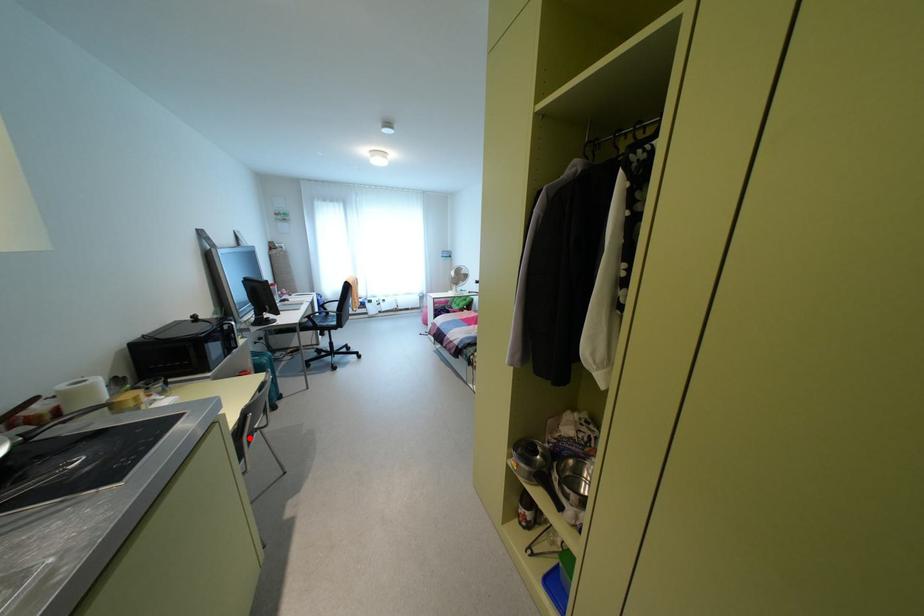
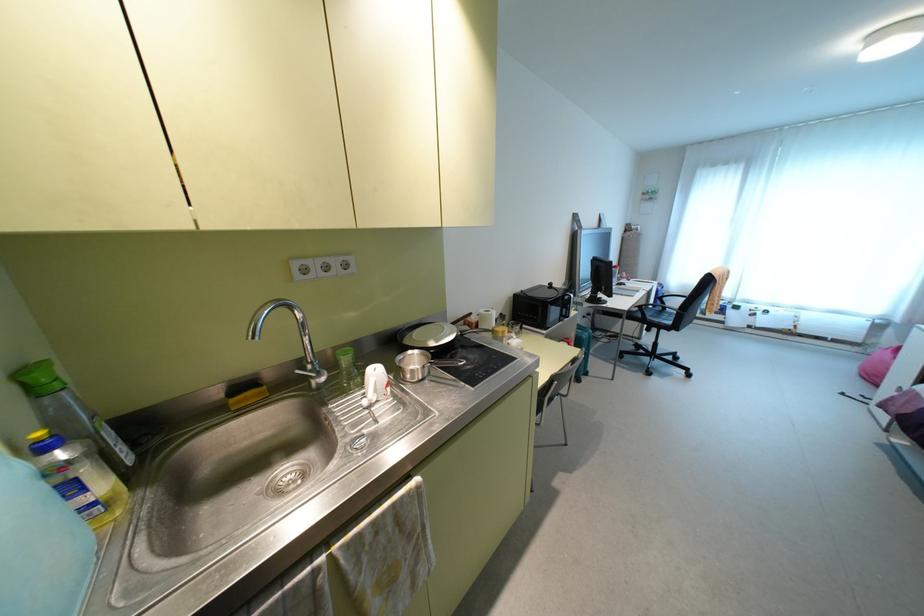
Question: I am providing you with two images of the same scene from different viewpoints. Given a red point in image1, look at the same physical point in image2. Is it:

Choices:
 (A) Closer to the viewpoint
 (B) Farther from the viewpoint

Answer: (B)